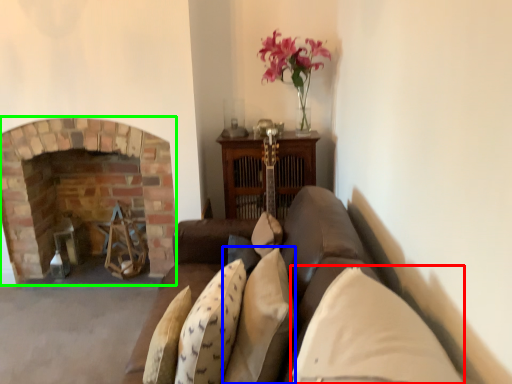
Question: Based on their relative distances, which object is nearer to pillow (highlighted by a red box)? Choose from pillow (highlighted by a blue box) and fireplace (highlighted by a green box).

Choices:
 (A) pillow
 (B) fireplace

Answer: (A)